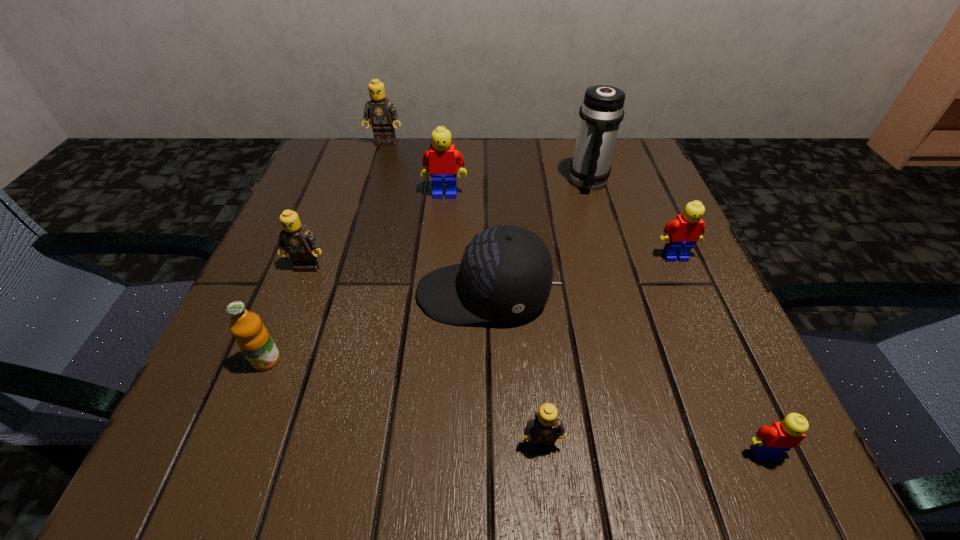
Locate an element on the screen. the smallest yellow Lego is located at coordinates (771, 441).

Find the location of a particular element. Image resolution: width=960 pixels, height=540 pixels. the rightmost tan Lego is located at coordinates (545, 427).

What are the coordinates of `the smallest tan Lego` in the screenshot? It's located at (545, 427).

Where is `vacant space located 0.350m on the side with the handle of the seventh object from left to right`? The image size is (960, 540). vacant space located 0.350m on the side with the handle of the seventh object from left to right is located at coordinates (633, 330).

The width and height of the screenshot is (960, 540). Identify the location of vacant space located 0.110m in front of the farthest object. click(x=377, y=171).

At what (x,y) coordinates should I click in order to perform the action: click on free space located on the front-facing side of the fourth Lego from right to left. Please return your answer as a coordinate pair (x, y). This screenshot has width=960, height=540. Looking at the image, I should click on (436, 292).

This screenshot has width=960, height=540. Identify the location of vacant region located at the front of the baseball cap where the brim is located. (327, 294).

In order to click on vacant space located at the front of the baseball cap where the brim is located in this screenshot , I will do `click(297, 294)`.

I want to click on vacant point located at the front of the baseball cap where the brim is located, so click(285, 294).

The image size is (960, 540). Find the location of `free space located 0.200m on the front-facing side of the second nearest yellow Lego`. free space located 0.200m on the front-facing side of the second nearest yellow Lego is located at coordinates (720, 357).